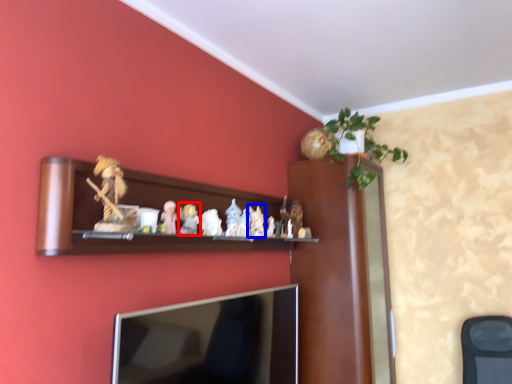
Question: Which object is further to the camera taking this photo, toy (highlighted by a red box) or toy (highlighted by a blue box)?

Choices:
 (A) toy
 (B) toy

Answer: (B)